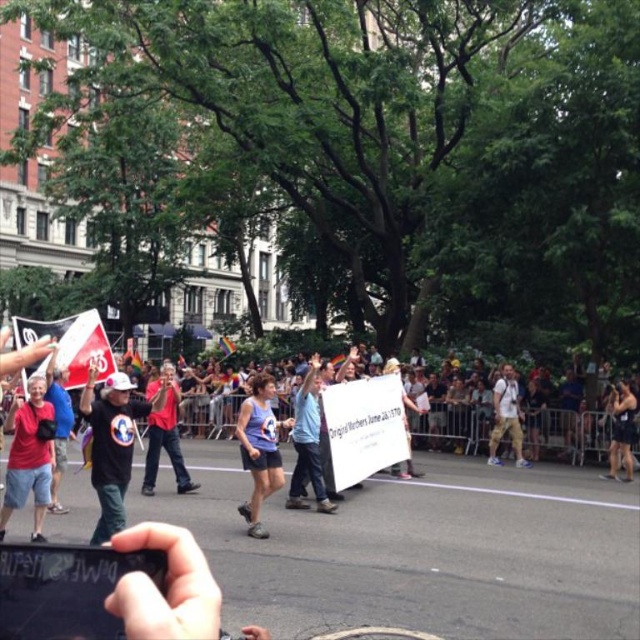
Is red cotton tank top at center positioned in front of white paper sign at center?

That is True.

Between red cotton tank top at center and white paper sign at center, which one is positioned higher?

red cotton tank top at center is higher up.

Locate an element on the screen. This screenshot has height=640, width=640. red cotton tank top at center is located at coordinates (164, 435).

Can you confirm if blue fabric shirt at center is wider than skinny jeans at center?

In fact, blue fabric shirt at center might be narrower than skinny jeans at center.

Which is behind, point (316, 387) or point (620, 412)?

Positioned behind is point (620, 412).

What are the coordinates of `blue fabric shirt at center` in the screenshot? It's located at (307, 444).

Does point (524, 461) lie behind point (628, 449)?

Yes, it is.

Which of these two, white cotton shirt at center or skinny jeans at center, stands shorter?

skinny jeans at center is shorter.

You are a GUI agent. You are given a task and a screenshot of the screen. Output one action in this format:
    pyautogui.click(x=<x>, y=<y>)
    Task: Click on the white cotton shirt at center
    
    Given the screenshot: What is the action you would take?
    pyautogui.click(x=506, y=417)